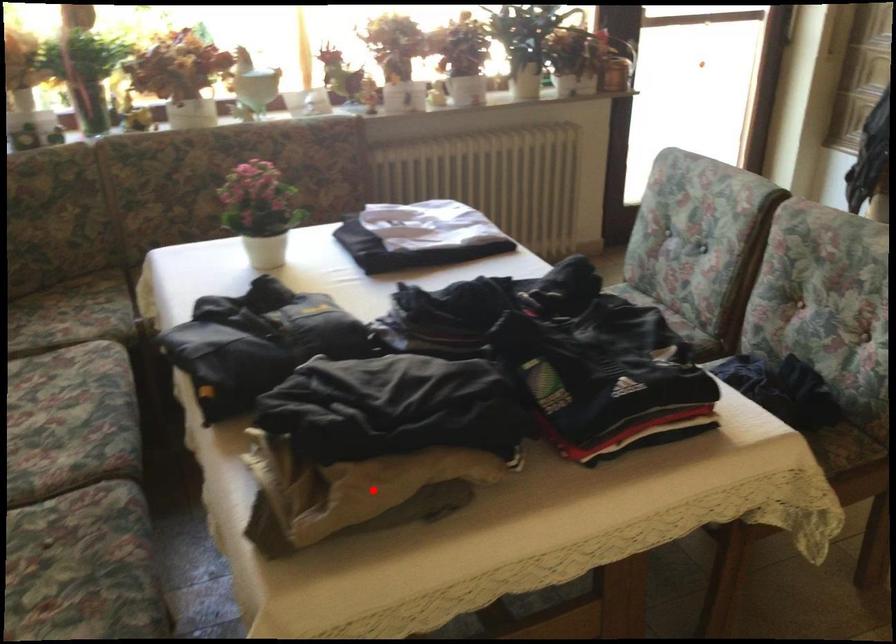
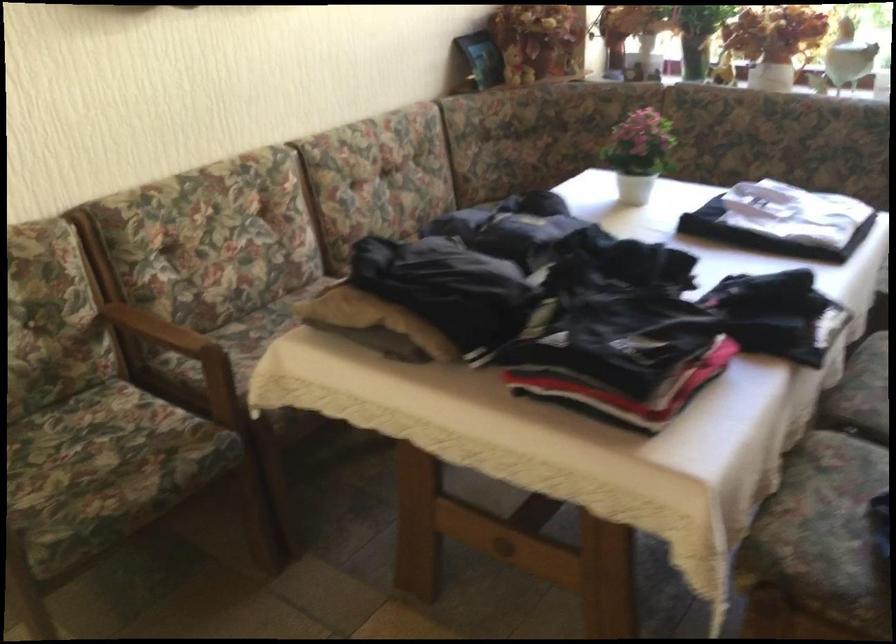
The point at the highlighted location is marked in the first image. Where is the corresponding point in the second image?

(351, 307)